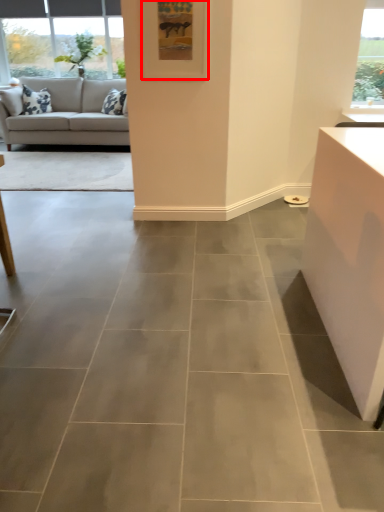
Question: From the image, what is the correct spatial relationship of picture frame (annotated by the red box) in relation to studio couch?

Choices:
 (A) left
 (B) right

Answer: (B)